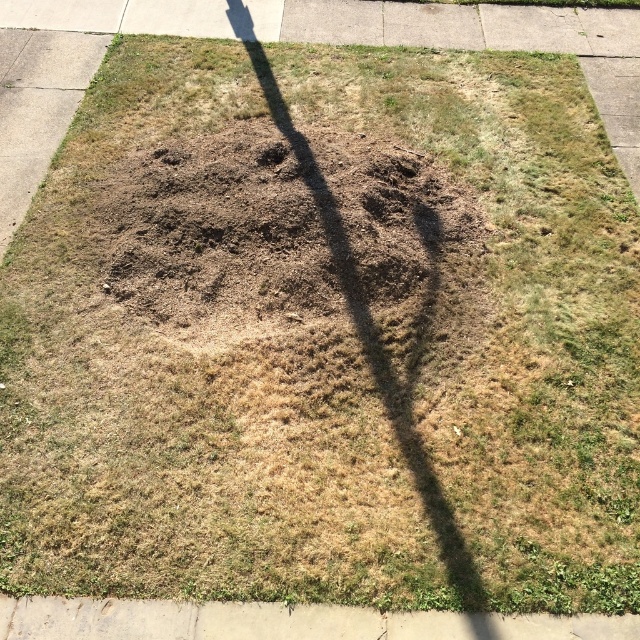
Question: Does gray concrete curb at lower left lie in front of dirt/soil at center?

Choices:
 (A) yes
 (B) no

Answer: (A)

Question: Is gray concrete curb at lower left positioned behind dirt/soil at center?

Choices:
 (A) yes
 (B) no

Answer: (B)

Question: Which object appears closest to the camera in this image?

Choices:
 (A) dirt/soil at center
 (B) gray concrete curb at lower left

Answer: (B)

Question: Can you confirm if gray concrete curb at lower left is bigger than dirt/soil at center?

Choices:
 (A) yes
 (B) no

Answer: (A)